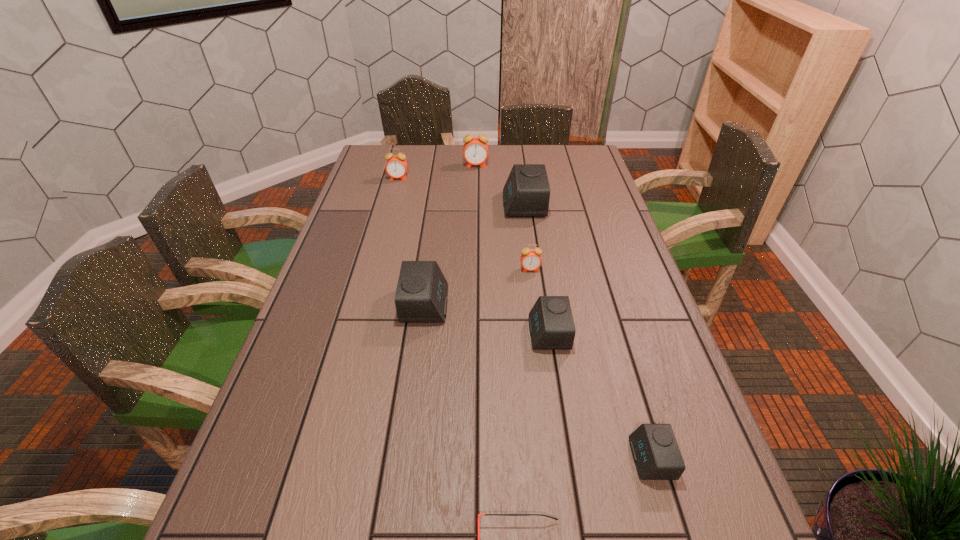
At what (x,y) coordinates should I click in order to perform the action: click on vacant region at the left edge of the desktop. Please return your answer as a coordinate pair (x, y). The width and height of the screenshot is (960, 540). Looking at the image, I should click on (335, 416).

Locate an element on the screen. vacant space at the right edge of the desktop is located at coordinates (562, 181).

This screenshot has width=960, height=540. In the image, there is a desktop. Find the location of `vacant space at the far left corner`. vacant space at the far left corner is located at coordinates (388, 150).

Locate an element on the screen. The height and width of the screenshot is (540, 960). vacant space at the far right corner is located at coordinates (555, 151).

This screenshot has width=960, height=540. I want to click on unoccupied position between the rightmost black alarm clock and the fourth farthest object, so click(590, 364).

Identify the location of free point between the nearest black alarm clock and the second alarm clock from left to right. Image resolution: width=960 pixels, height=540 pixels. (539, 382).

This screenshot has height=540, width=960. In order to click on free spot between the fifth alarm clock from right to left and the fifth nearest object in this screenshot , I will do `click(503, 218)`.

At what (x,y) coordinates should I click in order to perform the action: click on empty space that is in between the leftmost object and the second nearest object. Please return your answer as a coordinate pair (x, y). The height and width of the screenshot is (540, 960). Looking at the image, I should click on (525, 319).

Where is `vacant area between the smallest black alarm clock and the sixth alarm clock from right to left`? vacant area between the smallest black alarm clock and the sixth alarm clock from right to left is located at coordinates (539, 382).

Locate an element on the screen. This screenshot has width=960, height=540. vacant space that's between the biggest pink alarm clock and the fifth nearest alarm clock is located at coordinates (500, 185).